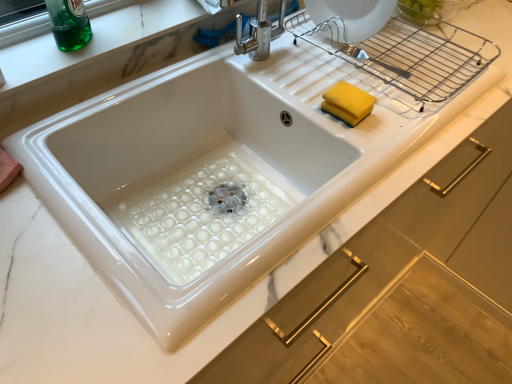
I want to click on free space to the left of green glass bottle at upper left, so click(32, 40).